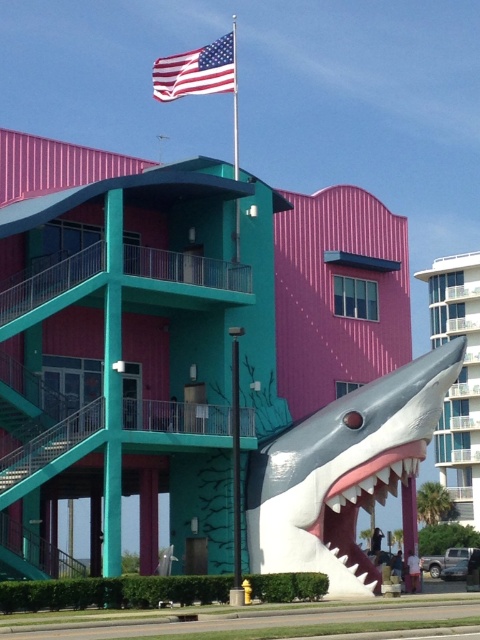
Can you confirm if pink corrugated metal building at upper center is thinner than smooth white shark at center?

Correct, pink corrugated metal building at upper center's width is less than smooth white shark at center's.

Who is shorter, pink corrugated metal building at upper center or smooth white shark at center?

pink corrugated metal building at upper center

Which is in front, point (66, 289) or point (435, 333)?

Point (66, 289) is more forward.

Locate an element on the screen. This screenshot has height=640, width=480. pink corrugated metal building at upper center is located at coordinates (171, 336).

Can you confirm if white glossy teeth at lower right is positioned below american flag at upper center?

Yes.

Is white glossy teeth at lower right bigger than american flag at upper center?

Incorrect, white glossy teeth at lower right is not larger than american flag at upper center.

This screenshot has width=480, height=640. I want to click on white glossy teeth at lower right, so click(x=369, y=500).

Identify the location of white glossy teeth at lower right. Image resolution: width=480 pixels, height=640 pixels. pyautogui.click(x=369, y=500).

Who is positioned more to the left, pink corrugated metal building at upper center or white glossy teeth at lower right?

Positioned to the left is pink corrugated metal building at upper center.

Who is more distant from viewer, (58,472) or (315,518)?

Point (315,518)

Who is more forward, (262,385) or (356,480)?

Positioned in front is point (356,480).

The width and height of the screenshot is (480, 640). I want to click on pink corrugated metal building at upper center, so click(x=171, y=336).